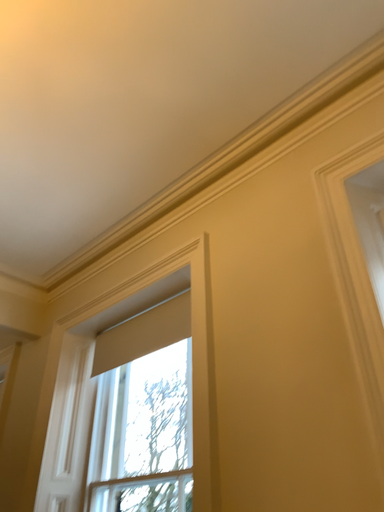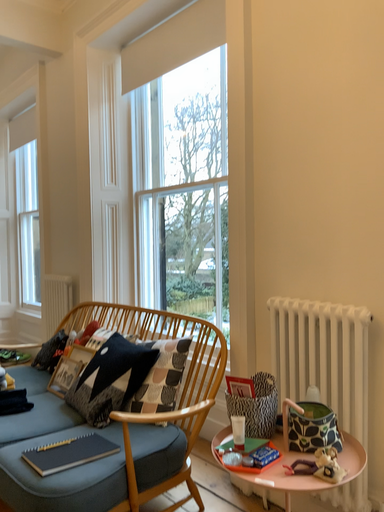
Question: How did the camera likely rotate when shooting the video?

Choices:
 (A) rotated upward
 (B) rotated downward

Answer: (B)